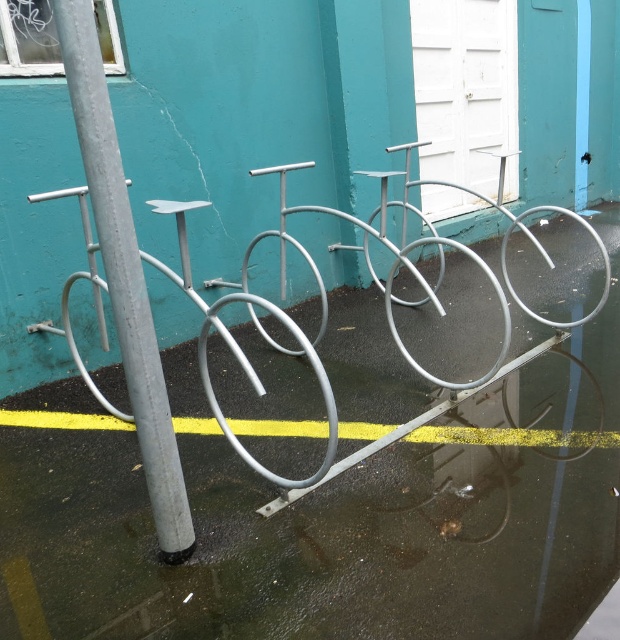
Question: Observing the image, what is the correct spatial positioning of smooth gray pole at left in reference to metallic silver bicycle at left?

Choices:
 (A) above
 (B) below

Answer: (A)

Question: In this image, where is smooth gray pole at left located relative to yellow painted line at lower center?

Choices:
 (A) left
 (B) right

Answer: (A)

Question: Considering the real-world distances, which object is closest to the metallic silver bicycle at left?

Choices:
 (A) yellow painted line at lower center
 (B) smooth gray pole at left

Answer: (A)

Question: Which is farther from the smooth gray pole at left?

Choices:
 (A) yellow painted line at lower center
 (B) metallic silver bicycle at left

Answer: (A)

Question: Does metallic silver bicycle at left appear on the left side of yellow painted line at lower center?

Choices:
 (A) no
 (B) yes

Answer: (B)

Question: Which object appears closest to the camera in this image?

Choices:
 (A) yellow painted line at lower center
 (B) metallic silver bicycle at left

Answer: (B)